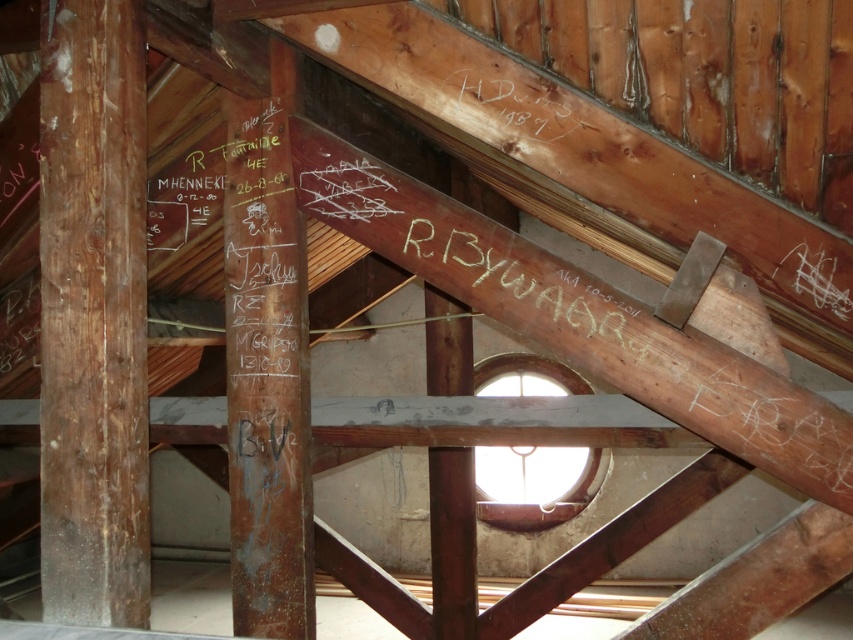
Question: Among these objects, which one is farthest from the camera?

Choices:
 (A) black wood writing at upper center
 (B) brown wood pillar at left

Answer: (A)

Question: Is brown wood pillar at center smaller than transparent glass window at center?

Choices:
 (A) yes
 (B) no

Answer: (A)

Question: Is brown wood pillar at left positioned at the back of black wood writing at upper center?

Choices:
 (A) yes
 (B) no

Answer: (B)

Question: Which point is farther from the camera taking this photo?

Choices:
 (A) (62, 429)
 (B) (461, 83)
 (C) (525, 360)
 (D) (299, 483)

Answer: (C)

Question: Which point is closer to the camera?

Choices:
 (A) (566, 456)
 (B) (71, 90)

Answer: (B)

Question: Is transparent glass window at center closer to the viewer compared to black wood writing at upper center?

Choices:
 (A) no
 (B) yes

Answer: (A)